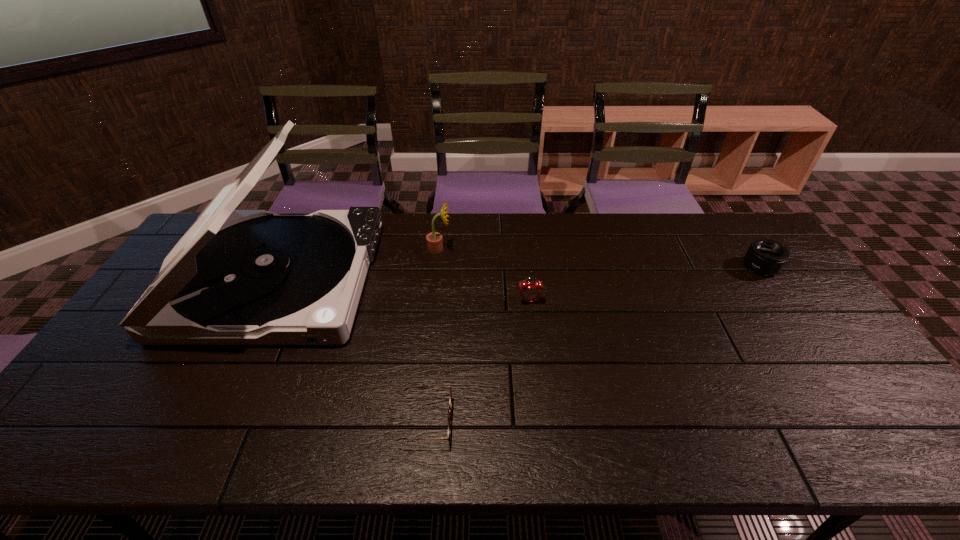
Where is `vacant space positioned 0.170m on the face of the sunflower`? Image resolution: width=960 pixels, height=540 pixels. vacant space positioned 0.170m on the face of the sunflower is located at coordinates (501, 248).

Locate an element on the screen. free location located on the face of the alarm clock is located at coordinates (532, 326).

Locate an element on the screen. vacant space located on the side of the rightmost object with brand markings and control switches is located at coordinates (724, 267).

Identify the location of free spot located 0.310m on the side of the rightmost object with brand markings and control switches. (646, 267).

Find the location of a particular element. vacant space located on the side of the rightmost object with brand markings and control switches is located at coordinates (699, 267).

Find the location of a particular element. free region located 0.200m at the front view of the nearest object is located at coordinates (537, 421).

Find the location of a particular element. Image resolution: width=960 pixels, height=540 pixels. CD player at the far edge is located at coordinates (236, 277).

Where is `sunflower that is at the far edge`? sunflower that is at the far edge is located at coordinates (434, 240).

Locate an element on the screen. This screenshot has height=540, width=960. telephoto lens positioned at the far edge is located at coordinates (764, 256).

I want to click on object located at the near edge, so click(x=450, y=402).